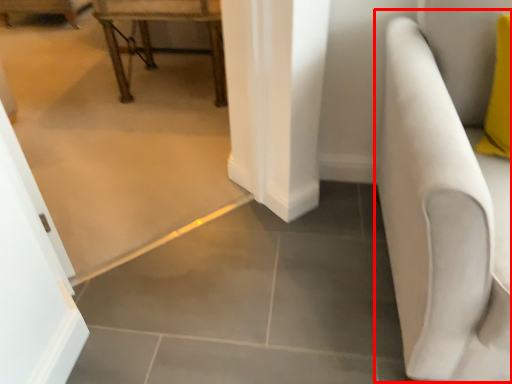
Question: In this image, where is armchair (annotated by the red box) located relative to furniture?

Choices:
 (A) left
 (B) right

Answer: (B)